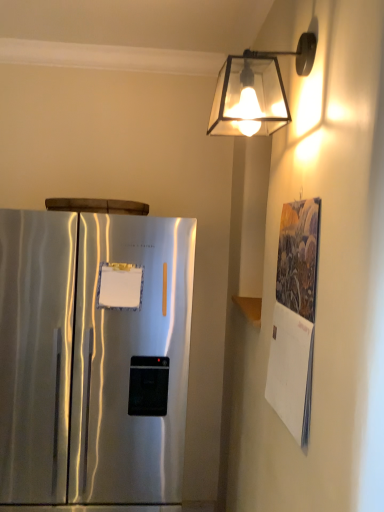
What is the approximate height of translucent glass lampshade at upper right?

The height of translucent glass lampshade at upper right is 10.63 inches.

What do you see at coordinates (93, 357) in the screenshot? I see `satin silver refrigerator at left` at bounding box center [93, 357].

This screenshot has height=512, width=384. Find the location of `translucent glass lampshade at upper right`. translucent glass lampshade at upper right is located at coordinates (256, 90).

In the scene shown: From a real-world perspective, who is located lower, translucent glass lampshade at upper right or satin silver refrigerator at left?

satin silver refrigerator at left.

Which is correct: translucent glass lampshade at upper right is inside satin silver refrigerator at left, or outside of it?

translucent glass lampshade at upper right cannot be found inside satin silver refrigerator at left.

Is textured paper calendar at right not close to translucent glass lampshade at upper right?

No, textured paper calendar at right is not far from translucent glass lampshade at upper right.

How distant is textured paper calendar at right from translucent glass lampshade at upper right?

They are 40.45 centimeters apart.

Considering the relative positions of textured paper calendar at right and translucent glass lampshade at upper right in the image provided, is textured paper calendar at right to the right of translucent glass lampshade at upper right from the viewer's perspective?

Indeed, textured paper calendar at right is positioned on the right side of translucent glass lampshade at upper right.

From the image's perspective, is translucent glass lampshade at upper right located above textured paper calendar at right?

Yes, from the image's perspective, translucent glass lampshade at upper right is above textured paper calendar at right.

How different are the orientations of translucent glass lampshade at upper right and textured paper calendar at right in degrees?

The angle between the facing direction of translucent glass lampshade at upper right and the facing direction of textured paper calendar at right is 1.98 degrees.

Is the depth of translucent glass lampshade at upper right greater than that of textured paper calendar at right?

Yes, translucent glass lampshade at upper right is further from the viewer.

Is point (259, 86) closer to viewer compared to point (293, 428)?

No.

Which is closer, (x=311, y=298) or (x=82, y=296)?

Point (x=311, y=298) is closer to the camera than point (x=82, y=296).

From the image's perspective, is textured paper calendar at right under satin silver refrigerator at left?

No, from the image's perspective, textured paper calendar at right is not below satin silver refrigerator at left.

In the image, there is a textured paper calendar at right. Where is `refrigerator below it (from the image's perspective)`? This screenshot has height=512, width=384. refrigerator below it (from the image's perspective) is located at coordinates (93, 357).

Does satin silver refrigerator at left turn towards translucent glass lampshade at upper right?

No, satin silver refrigerator at left is not turned towards translucent glass lampshade at upper right.

In terms of height, does satin silver refrigerator at left look taller or shorter compared to translucent glass lampshade at upper right?

satin silver refrigerator at left is taller than translucent glass lampshade at upper right.

From a real-world perspective, relative to textured paper calendar at right, is satin silver refrigerator at left vertically above or below?

In terms of real-world spatial position, satin silver refrigerator at left is below textured paper calendar at right.

From the image's perspective, which object appears higher, satin silver refrigerator at left or textured paper calendar at right?

textured paper calendar at right is shown above in the image.

Based on their positions, is satin silver refrigerator at left located to the left or right of textured paper calendar at right?

Based on their positions, satin silver refrigerator at left is located to the left of textured paper calendar at right.

Is point (18, 435) farther from viewer compared to point (281, 245)?

Yes, point (18, 435) is farther from viewer.

Locate an element on the screen. refrigerator behind the translucent glass lampshade at upper right is located at coordinates (93, 357).

The image size is (384, 512). In the image, there is a textured paper calendar at right. What are the coordinates of `lamp above it (from the image's perspective)` in the screenshot? It's located at (256, 90).

Estimate the real-world distances between objects in this image. Which object is closer to satin silver refrigerator at left, translucent glass lampshade at upper right or textured paper calendar at right?

textured paper calendar at right lies closer to satin silver refrigerator at left than the other object.

Estimate the real-world distances between objects in this image. Which object is closer to textured paper calendar at right, translucent glass lampshade at upper right or satin silver refrigerator at left?

Among the two, translucent glass lampshade at upper right is located nearer to textured paper calendar at right.

When comparing their distances from textured paper calendar at right, does satin silver refrigerator at left or translucent glass lampshade at upper right seem further?

satin silver refrigerator at left is positioned further to the anchor textured paper calendar at right.

Considering their positions, is textured paper calendar at right positioned further to translucent glass lampshade at upper right than satin silver refrigerator at left?

Among the two, satin silver refrigerator at left is located further to translucent glass lampshade at upper right.

Looking at this image, which object lies further to the anchor point satin silver refrigerator at left, textured paper calendar at right or translucent glass lampshade at upper right?

translucent glass lampshade at upper right.

Considering their positions, is satin silver refrigerator at left positioned further to translucent glass lampshade at upper right than textured paper calendar at right?

satin silver refrigerator at left is further to translucent glass lampshade at upper right.

Image resolution: width=384 pixels, height=512 pixels. Identify the location of poster between translucent glass lampshade at upper right and satin silver refrigerator at left from top to bottom. (294, 318).